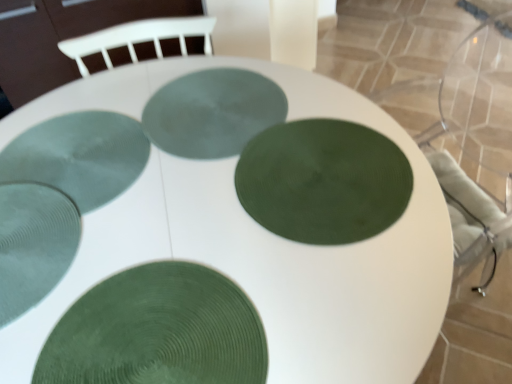
At what (x,y) coordinates should I click in order to perform the action: click on vacant space that is in between green textured glass plate at center, which ranks as the third glass plate in front-to-back order, and green textured plate at center, which is the 5th glass plate from back to front. Please return your answer as a coordinate pair (x, y). This screenshot has width=512, height=384. Looking at the image, I should click on (267, 251).